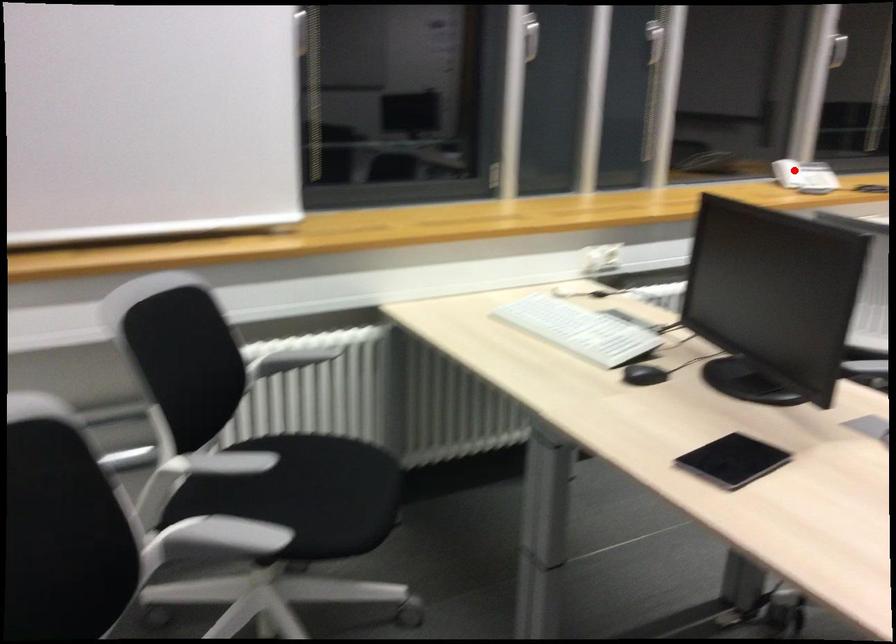
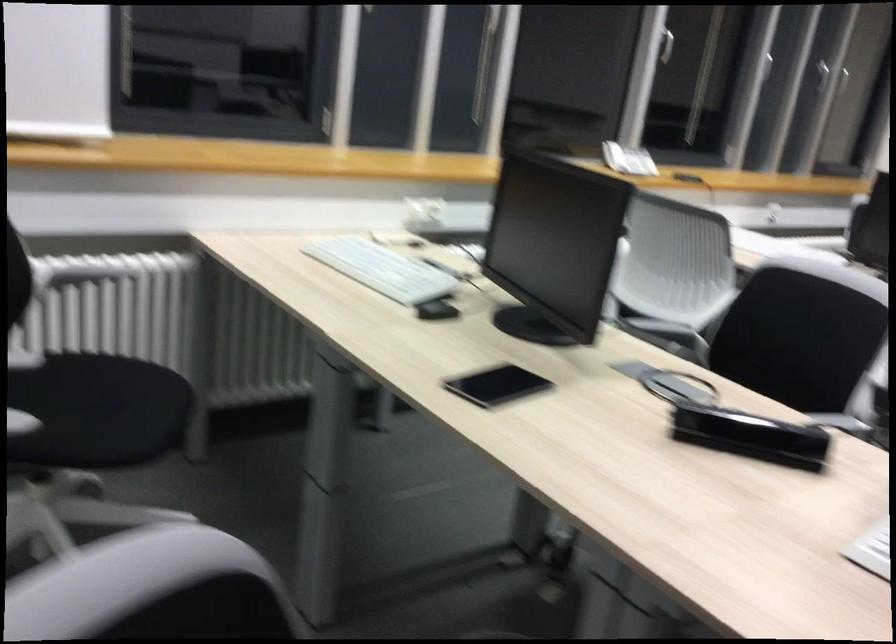
The point at the highlighted location is marked in the first image. Where is the corresponding point in the second image?

(614, 156)